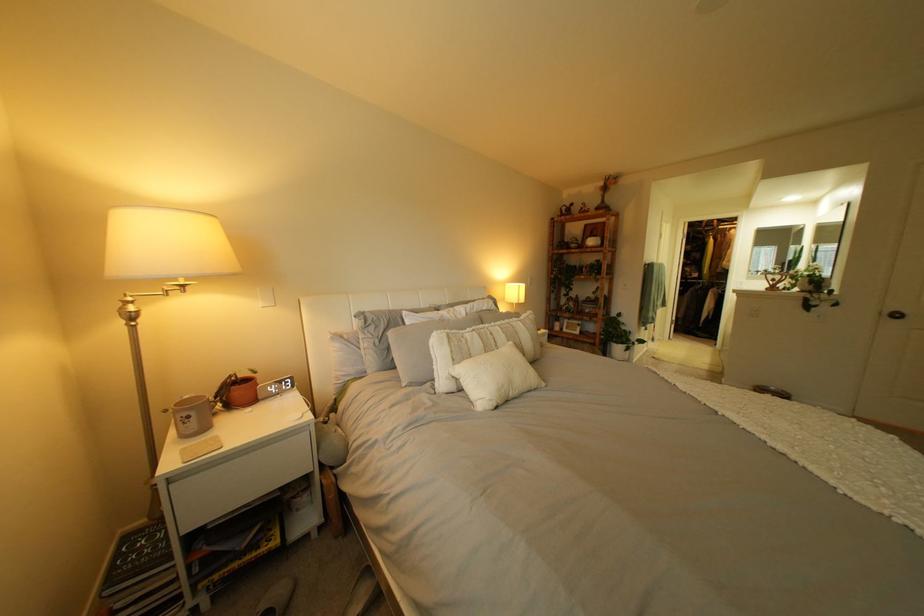
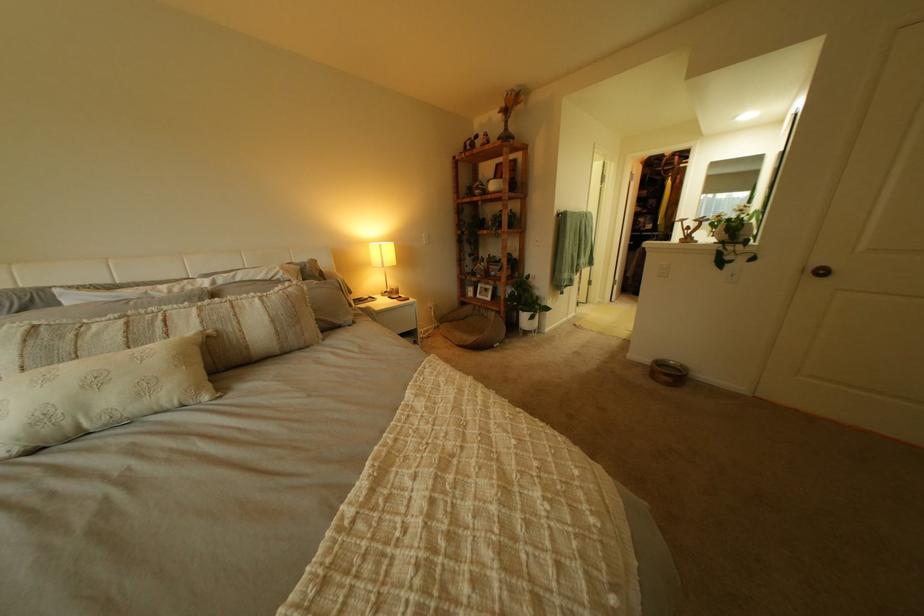
The point at (x=613, y=346) is marked in the first image. Where is the corresponding point in the second image?

(517, 314)